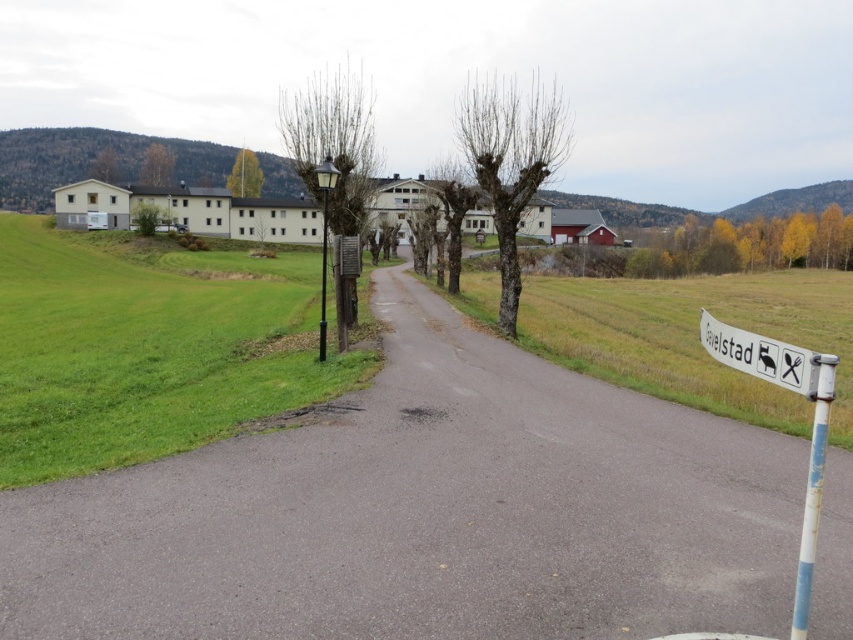
Question: Which object is positioned closest to the white plastic sign at right?

Choices:
 (A) asphalt at center
 (B) metallic pole at left
 (C) white painted metal pole at right

Answer: (A)

Question: From the image, what is the correct spatial relationship of white plastic sign at right in relation to white painted metal pole at right?

Choices:
 (A) right
 (B) left

Answer: (A)

Question: Can you confirm if asphalt at center is smaller than white plastic sign at right?

Choices:
 (A) no
 (B) yes

Answer: (B)

Question: Which of the following is the closest to the observer?

Choices:
 (A) (570, 616)
 (B) (735, 337)
 (C) (822, 465)

Answer: (C)

Question: Can you confirm if asphalt at center is positioned to the right of metallic pole at left?

Choices:
 (A) no
 (B) yes

Answer: (B)

Question: Which is farther from the asphalt at center?

Choices:
 (A) white painted metal pole at right
 (B) white plastic sign at right

Answer: (A)